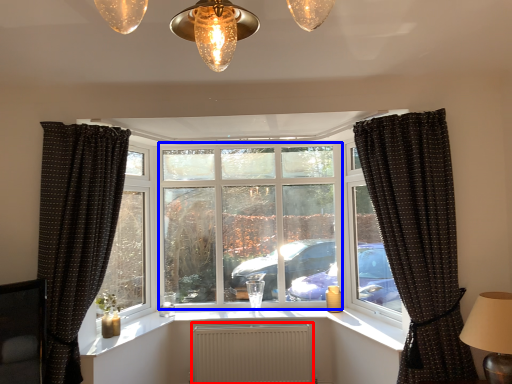
Question: Which point is further to the camera, radiator (highlighted by a red box) or window screen (highlighted by a blue box)?

Choices:
 (A) radiator
 (B) window screen

Answer: (B)